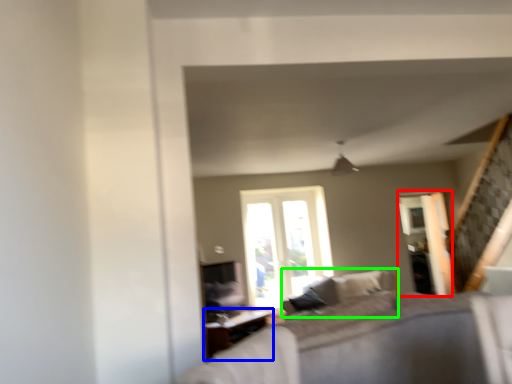
Question: Based on their relative distances, which object is farther from screen door (highlighted by a red box)? Choose from table (highlighted by a blue box) and couch (highlighted by a green box).

Choices:
 (A) table
 (B) couch

Answer: (A)